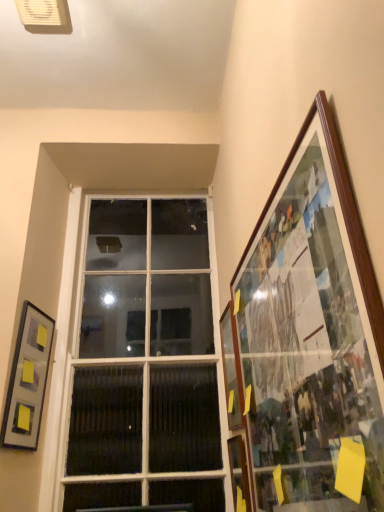
Question: Is wooden-framed collage at right, which is the 3th picture frame from left to right, located within matte gray picture frame at left, the 1th picture frame when ordered from left to right?

Choices:
 (A) no
 (B) yes

Answer: (A)

Question: Is matte gray picture frame at left, marked as the 3th picture frame in a right-to-left arrangement, directly adjacent to wooden-framed collage at right, which is the 3th picture frame from left to right?

Choices:
 (A) yes
 (B) no

Answer: (B)

Question: Considering the relative sizes of matte gray picture frame at left, marked as the 3th picture frame in a right-to-left arrangement, and wooden-framed collage at right, the 1th picture frame from the right, in the image provided, is matte gray picture frame at left, marked as the 3th picture frame in a right-to-left arrangement, bigger than wooden-framed collage at right, the 1th picture frame from the right,?

Choices:
 (A) no
 (B) yes

Answer: (A)

Question: Considering the relative sizes of matte gray picture frame at left, marked as the 3th picture frame in a right-to-left arrangement, and wooden-framed collage at right, the 1th picture frame from the right, in the image provided, is matte gray picture frame at left, marked as the 3th picture frame in a right-to-left arrangement, smaller than wooden-framed collage at right, the 1th picture frame from the right,?

Choices:
 (A) yes
 (B) no

Answer: (A)

Question: Is matte gray picture frame at left, the 1th picture frame when ordered from left to right, looking in the opposite direction of wooden-framed collage at right, the 1th picture frame from the right?

Choices:
 (A) no
 (B) yes

Answer: (A)

Question: From the image's perspective, does matte gray picture frame at left, marked as the 3th picture frame in a right-to-left arrangement, appear higher than wooden-framed collage at right, which is the 3th picture frame from left to right?

Choices:
 (A) yes
 (B) no

Answer: (B)

Question: From a real-world perspective, is wooden picture frame at right, positioned as the second picture frame in right-to-left order, on wooden-framed collage at right, which is the 3th picture frame from left to right?

Choices:
 (A) no
 (B) yes

Answer: (B)

Question: From the image's perspective, would you say wooden picture frame at right, positioned as the second picture frame in right-to-left order, is positioned over wooden-framed collage at right, the 1th picture frame from the right?

Choices:
 (A) no
 (B) yes

Answer: (A)

Question: Is wooden picture frame at right, positioned as the second picture frame in right-to-left order, thinner than wooden-framed collage at right, which is the 3th picture frame from left to right?

Choices:
 (A) no
 (B) yes

Answer: (B)

Question: Is wooden picture frame at right, positioned as the second picture frame in right-to-left order, bigger than wooden-framed collage at right, the 1th picture frame from the right?

Choices:
 (A) yes
 (B) no

Answer: (B)

Question: Could you tell me if wooden picture frame at right, which is counted as the second picture frame, starting from the left, is facing wooden-framed collage at right, the 1th picture frame from the right?

Choices:
 (A) no
 (B) yes

Answer: (A)

Question: Is wooden picture frame at right, positioned as the second picture frame in right-to-left order, shorter than wooden-framed collage at right, which is the 3th picture frame from left to right?

Choices:
 (A) yes
 (B) no

Answer: (A)

Question: Does matte gray picture frame at left, marked as the 3th picture frame in a right-to-left arrangement, touch white glass window at center?

Choices:
 (A) no
 (B) yes

Answer: (A)